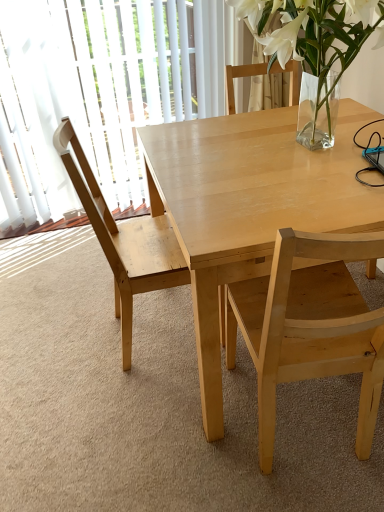
Question: From a real-world perspective, is light wood chair at center, which ranks as the 2th chair in left-to-right order, above or below transparent glass door at left?

Choices:
 (A) below
 (B) above

Answer: (A)

Question: Looking at their shapes, would you say light wood chair at center, which ranks as the 2th chair in left-to-right order, is wider or thinner than transparent glass door at left?

Choices:
 (A) thin
 (B) wide

Answer: (B)

Question: Which of these objects is positioned farthest from the transparent glass door at left?

Choices:
 (A) light wood table at center
 (B) light wood chair at center, placed as the first chair when sorted from right to left
 (C) clear glass vase at upper right
 (D) light wood chair at left, which is the first chair from left to right

Answer: (B)

Question: Which is nearer to the clear glass vase at upper right?

Choices:
 (A) transparent glass door at left
 (B) light wood chair at center, placed as the first chair when sorted from right to left
 (C) light wood chair at left, which is the first chair from left to right
 (D) light wood table at center

Answer: (D)